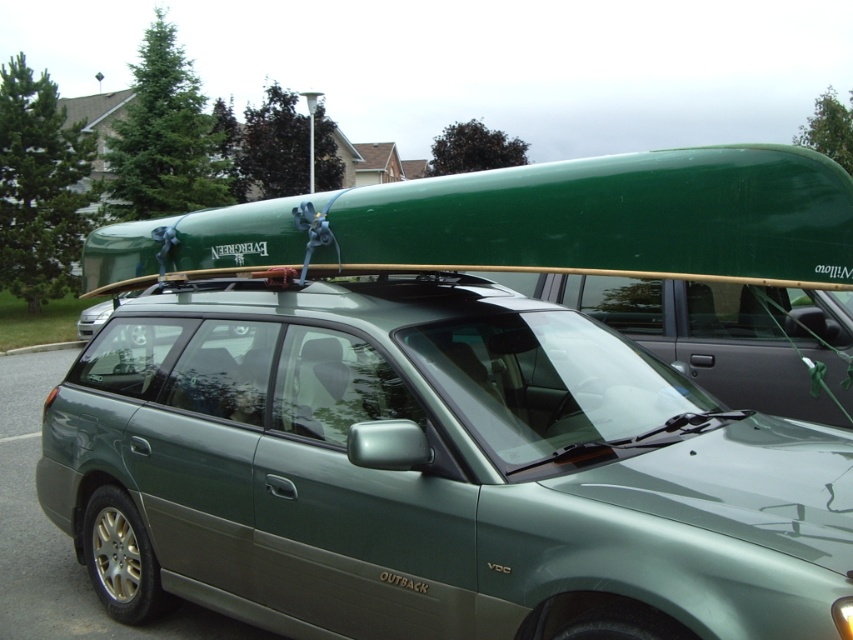
Which is above, green matte car at center or green matte surfboard at upper center?

green matte surfboard at upper center is higher up.

Which is in front, point (741, 454) or point (358, 257)?

Point (741, 454)

Is point (432, 608) positioned after point (450, 257)?

No.

Identify the location of green matte car at center. (434, 472).